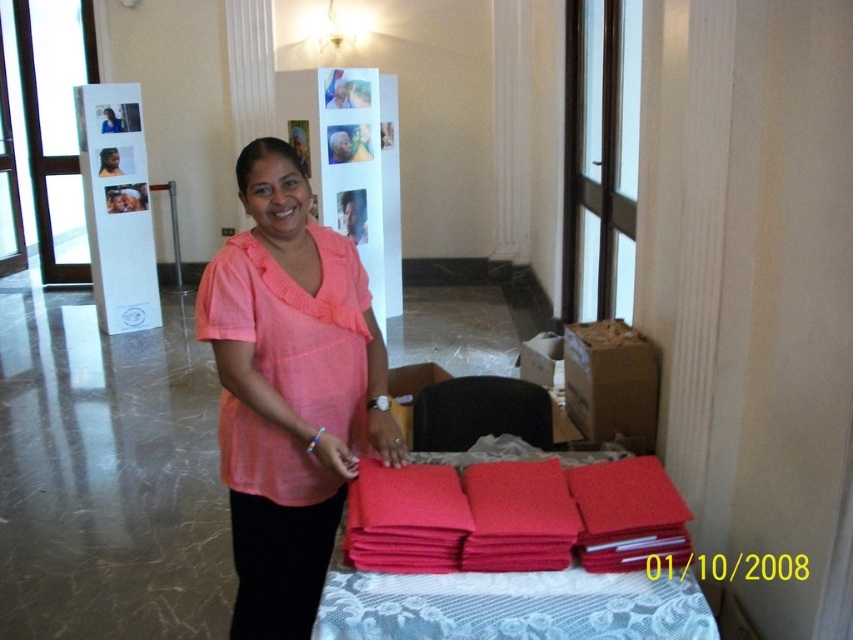
Question: From the image, what is the correct spatial relationship of pink cotton shirt at center in relation to matte red folder at lower center?

Choices:
 (A) below
 (B) above

Answer: (B)

Question: Can you confirm if pink cotton shirt at center is positioned above white lace tablecloth at center?

Choices:
 (A) no
 (B) yes

Answer: (B)

Question: Among these points, which one is farthest from the camera?

Choices:
 (A) (238, 428)
 (B) (376, 595)
 (C) (337, 577)

Answer: (A)

Question: Is pink cotton shirt at center further to camera compared to matte red folder at lower center?

Choices:
 (A) yes
 (B) no

Answer: (A)

Question: Which object is positioned farthest from the matte red folder at lower center?

Choices:
 (A) white lace tablecloth at center
 (B) pink cotton shirt at center

Answer: (B)

Question: Among these points, which one is farthest from the camera?

Choices:
 (A) (550, 612)
 (B) (241, 545)

Answer: (B)